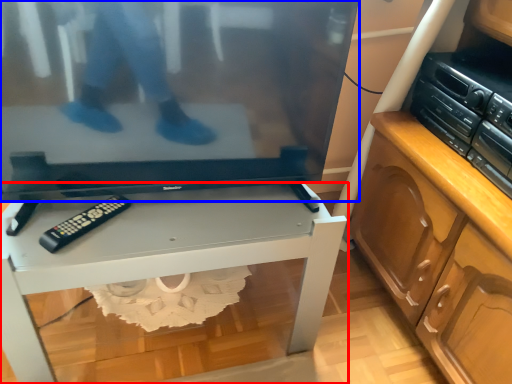
Question: Which object appears farthest to the camera in this image, desk (highlighted by a red box) or television (highlighted by a blue box)?

Choices:
 (A) desk
 (B) television

Answer: (A)